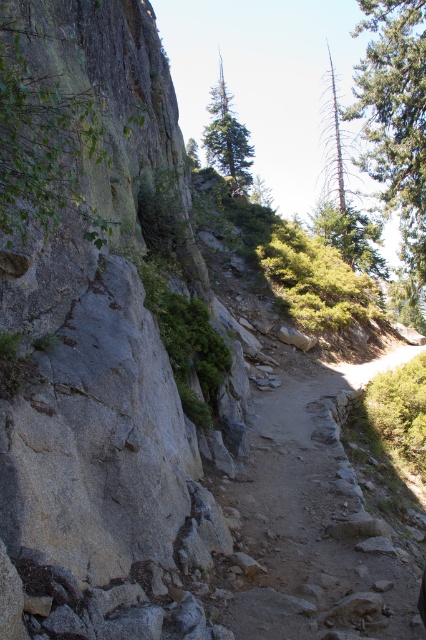
Based on the photo, you are standing at the point marked by the coordinate (317, 518) in the image. Which object from the scene is directly under your feet?

The dirt path at center is located at point (317, 518), so the object directly under your feet is the dirt path at center.

You are standing at the camera position looking at the rugged landscape. There are two points marked in the scene. Which of the two points, point (331,582) or point (219,93), is closer to you?

Point (331,582) is closer to the camera than point (219,93).